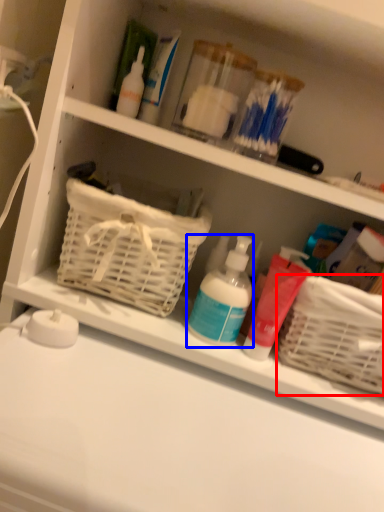
Question: Among these objects, which one is farthest to the camera, basket (highlighted by a red box) or cleaning product (highlighted by a blue box)?

Choices:
 (A) basket
 (B) cleaning product

Answer: (B)